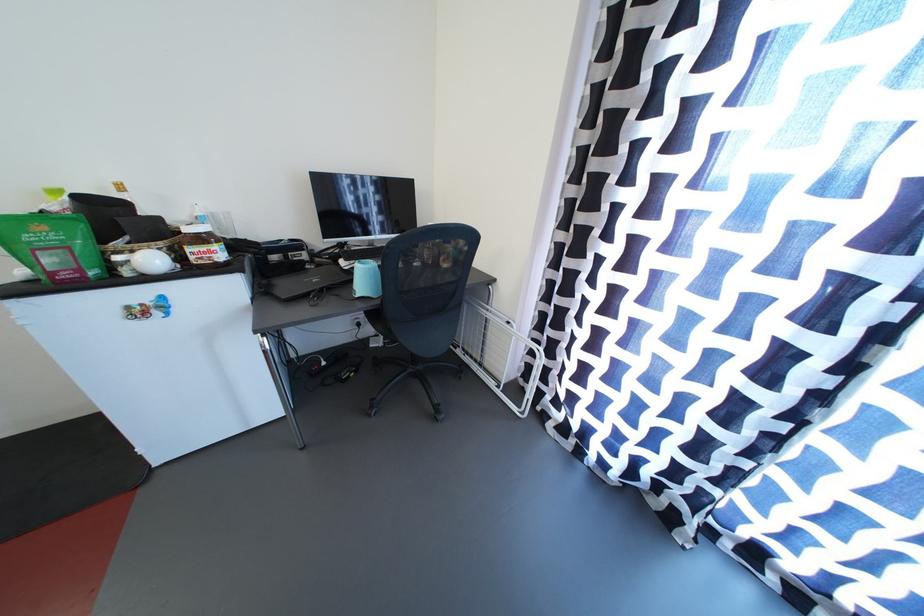
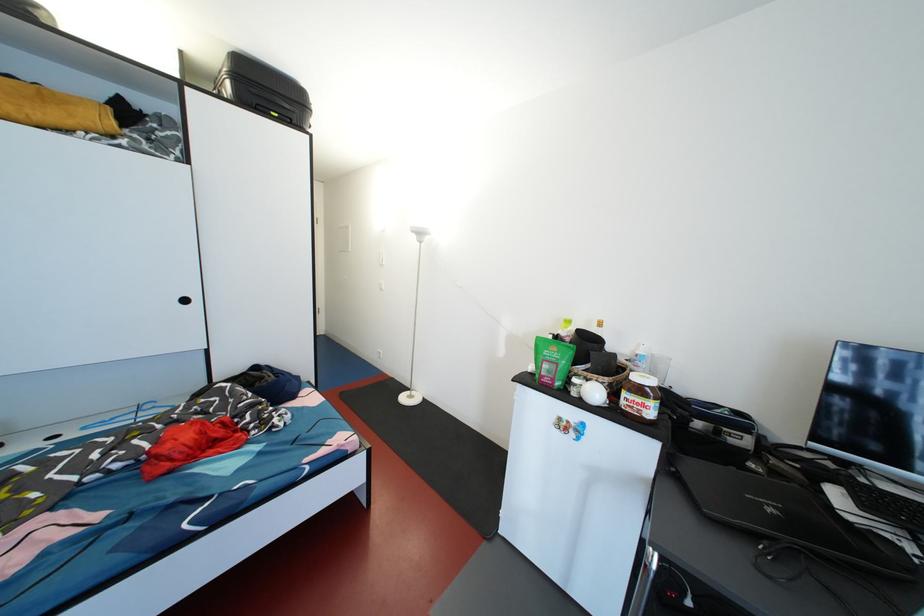
Locate, in the second image, the point that corresponds to point 157,265 in the first image.

(601, 397)